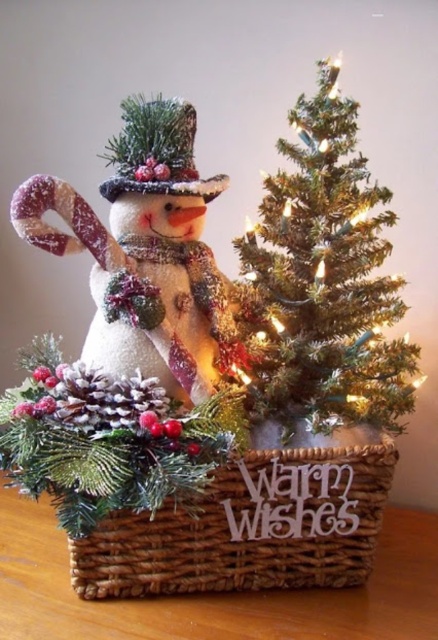
Based on the photo, does green textured christmas tree at center have a smaller size compared to woven brown basket at center?

No.

Is green textured christmas tree at center positioned at the back of woven brown basket at center?

Yes.

Does point (272, 234) come farther from viewer compared to point (151, 529)?

That is True.

In order to click on green textured christmas tree at center in this screenshot , I will do `click(325, 280)`.

Is green textured christmas tree at center smaller than frosted fabric snowman at center?

Incorrect, green textured christmas tree at center is not smaller in size than frosted fabric snowman at center.

Is green textured christmas tree at center wider than frosted fabric snowman at center?

In fact, green textured christmas tree at center might be narrower than frosted fabric snowman at center.

The height and width of the screenshot is (640, 438). What do you see at coordinates (325, 280) in the screenshot?
I see `green textured christmas tree at center` at bounding box center [325, 280].

The image size is (438, 640). In order to click on green textured christmas tree at center in this screenshot , I will do `click(325, 280)`.

Between frosted fabric snowman at center and woven brown basket at center, which one appears on the left side from the viewer's perspective?

frosted fabric snowman at center

Is frosted fabric snowman at center thinner than woven brown basket at center?

Correct, frosted fabric snowman at center's width is less than woven brown basket at center's.

Who is more forward, (x=50, y=179) or (x=193, y=538)?

Point (x=50, y=179) is in front.

I want to click on frosted fabric snowman at center, so click(x=145, y=253).